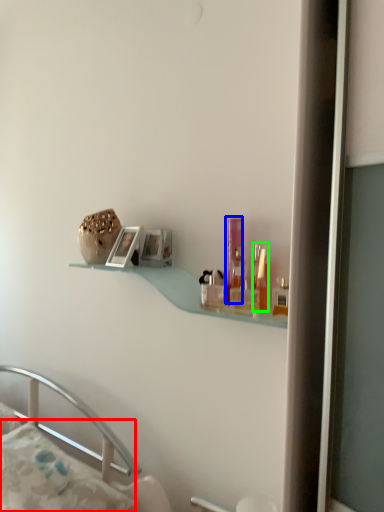
Question: Considering the real-world distances, which object is farthest from pillow (highlighted by a red box)? toiletry (highlighted by a blue box) or toiletry (highlighted by a green box)?

Choices:
 (A) toiletry
 (B) toiletry

Answer: (B)